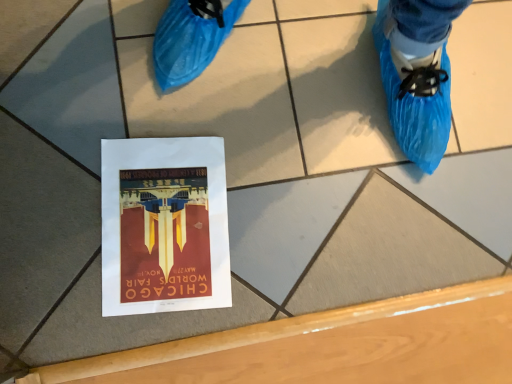
You are a GUI agent. You are given a task and a screenshot of the screen. Output one action in this format:
    pyautogui.click(x=<x>, y=<y>)
    Task: Click on the vacant space that is to the left of matte paper poster at center
    
    Given the screenshot: What is the action you would take?
    pyautogui.click(x=72, y=145)